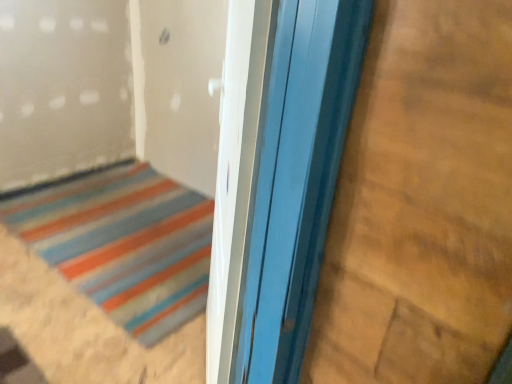
Image resolution: width=512 pixels, height=384 pixels. What do you see at coordinates (422, 204) in the screenshot?
I see `smooth wood plywood at right` at bounding box center [422, 204].

Locate an element on the screen. This screenshot has width=512, height=384. smooth wood plywood at right is located at coordinates (422, 204).

Describe the element at coordinates (124, 244) in the screenshot. I see `wooden door at center` at that location.

Measure the distance between point (x=158, y=328) and camera.

The distance of point (x=158, y=328) from camera is 1.89 meters.

I want to click on wooden door at center, so click(124, 244).

Where is `smooth wood plywood at right`? This screenshot has width=512, height=384. smooth wood plywood at right is located at coordinates (422, 204).

Is wooden door at center at the right side of smooth wood plywood at right?

Incorrect, wooden door at center is not on the right side of smooth wood plywood at right.

Is wooden door at center further to camera compared to smooth wood plywood at right?

Yes, the depth of wooden door at center is greater than that of smooth wood plywood at right.

Which is in front, point (194, 229) or point (480, 186)?

Positioned in front is point (480, 186).

From the image's perspective, is wooden door at center located beneath smooth wood plywood at right?

Correct, wooden door at center appears lower than smooth wood plywood at right in the image.

From a real-world perspective, is wooden door at center on top of smooth wood plywood at right?

Incorrect, from a real-world perspective, wooden door at center is lower than smooth wood plywood at right.

Which of these two, wooden door at center or smooth wood plywood at right, is thinner?

With smaller width is smooth wood plywood at right.

From their relative heights in the image, would you say wooden door at center is taller or shorter than smooth wood plywood at right?

Considering their sizes, wooden door at center has less height than smooth wood plywood at right.

Which of these two, wooden door at center or smooth wood plywood at right, is bigger?

A: Bigger between the two is wooden door at center.

Would you say smooth wood plywood at right is part of wooden door at center's contents?

No, smooth wood plywood at right is not inside wooden door at center.

Is wooden door at center in contact with smooth wood plywood at right?

No, wooden door at center is not in contact with smooth wood plywood at right.

Is wooden door at center facing towards smooth wood plywood at right?

No, wooden door at center is not aimed at smooth wood plywood at right.

What's the angular difference between wooden door at center and smooth wood plywood at right's facing directions?

The angle between the facing direction of wooden door at center and the facing direction of smooth wood plywood at right is 91.4 degrees.

This screenshot has width=512, height=384. I want to click on door located behind the smooth wood plywood at right, so click(x=124, y=244).

Is smooth wood plywood at right to the left of wooden door at center from the viewer's perspective?

In fact, smooth wood plywood at right is to the right of wooden door at center.

From the picture: Is smooth wood plywood at right positioned behind wooden door at center?

No.

Which is behind, point (485, 360) or point (59, 258)?

The point (59, 258) is farther from the camera.

From the image's perspective, is smooth wood plywood at right located above or below wooden door at center?

smooth wood plywood at right is above wooden door at center.

From a real-world perspective, is smooth wood plywood at right positioned over wooden door at center based on gravity?

Yes, from a real-world perspective, smooth wood plywood at right is on top of wooden door at center.

Between smooth wood plywood at right and wooden door at center, which one has smaller width?

smooth wood plywood at right.

Considering the relative sizes of smooth wood plywood at right and wooden door at center in the image provided, is smooth wood plywood at right taller than wooden door at center?

Yes, smooth wood plywood at right is taller than wooden door at center.

In terms of size, does smooth wood plywood at right appear bigger or smaller than wooden door at center?

Clearly, smooth wood plywood at right is smaller in size than wooden door at center.

Is smooth wood plywood at right inside the boundaries of wooden door at center, or outside?

smooth wood plywood at right lies outside wooden door at center.

Is smooth wood plywood at right next to wooden door at center?

No, smooth wood plywood at right is not in contact with wooden door at center.

Could you tell me if smooth wood plywood at right is facing wooden door at center?

No, smooth wood plywood at right is not aimed at wooden door at center.

What's the angular difference between smooth wood plywood at right and wooden door at center's facing directions?

91.4 degrees.

Find the location of a particular element. The height and width of the screenshot is (384, 512). door below the smooth wood plywood at right (from a real-world perspective) is located at coordinates (124, 244).

The image size is (512, 384). I want to click on plywood that appears above the wooden door at center (from a real-world perspective), so click(x=422, y=204).

You are a GUI agent. You are given a task and a screenshot of the screen. Output one action in this format:
    pyautogui.click(x=<x>, y=<y>)
    Task: Click on the plywood lying in front of the wooden door at center
    
    Given the screenshot: What is the action you would take?
    pyautogui.click(x=422, y=204)